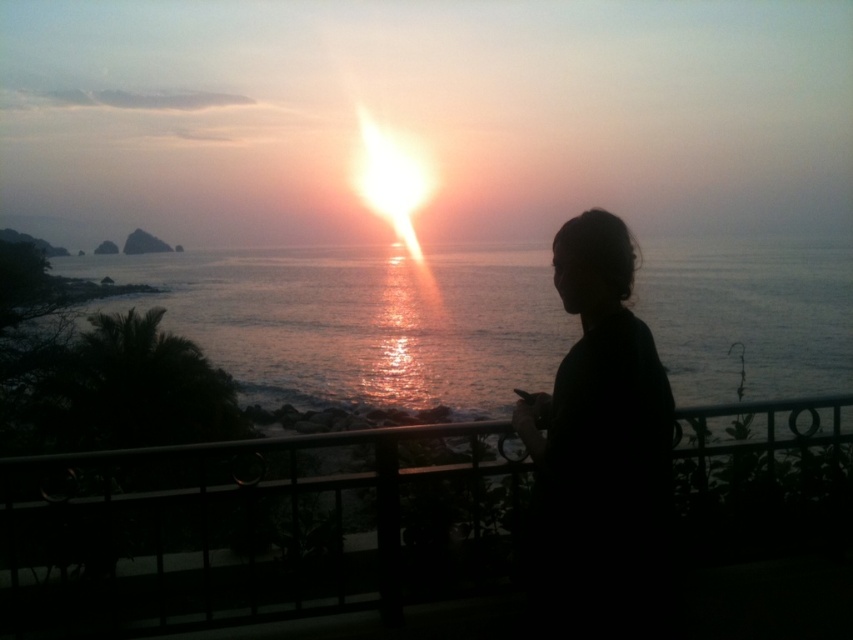
You are a photographer trying to capture the sunset scene. You notice the black metal railing at center and the black matte hair at center in your viewfinder. Which object should you focus on first if you want to ensure both are in sharp focus?

You should focus on the black metal railing at center first because it is closer to you than the black matte hair at center. Since it is closer, focusing on it will ensure that the black matte hair at center, which is further away, will also be in focus if your depth of field is sufficient. However, if the depth of field is limited, you might need to focus somewhere between them or adjust your settings to ensure both are sharp.

You are standing on the balcony and want to place a small potted plant exactly at the point marked by coordinates point (x=264, y=529). Is this location on the black metal railing at center?

Yes, the point (x=264, y=529) is on the black metal railing at center, so placing the potted plant there would be possible.

You are a photographer trying to capture the sunset scene. You notice the black metal railing at center and the black matte hair at center in your frame. Which object should you focus on if you want to highlight the larger object in your photo?

You should focus on the black metal railing at center because it has a larger size compared to the black matte hair at center, making it the more prominent object in the scene.